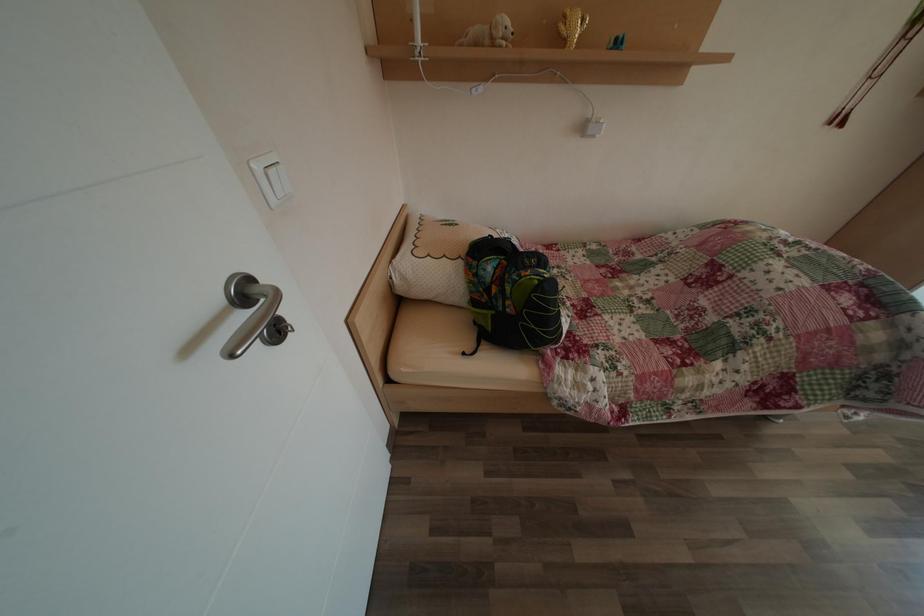
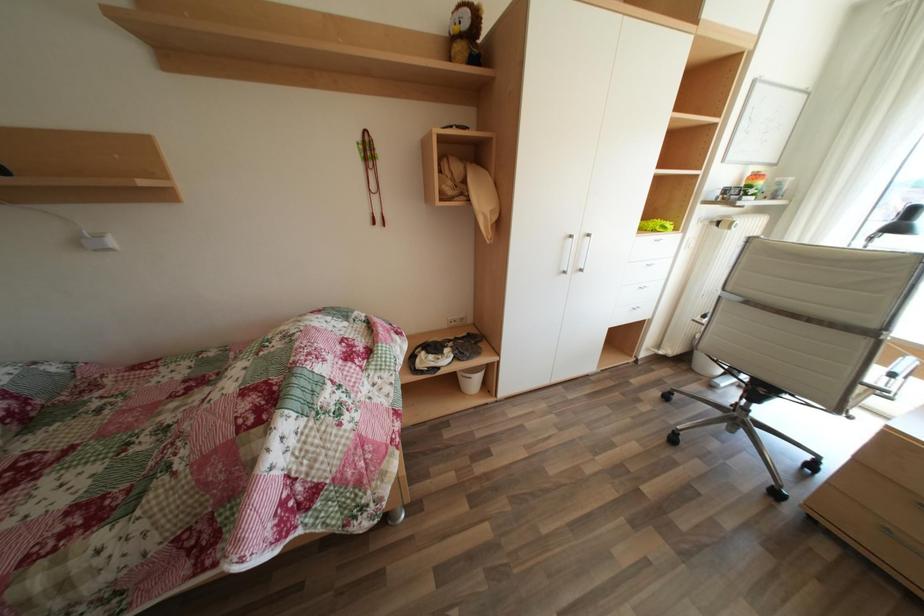
Question: Which direction would the cameraman need to move to produce the second image? Reply with the corresponding letter.

Choices:
 (A) Left
 (B) Right
 (C) Forward
 (D) Backward

Answer: (B)